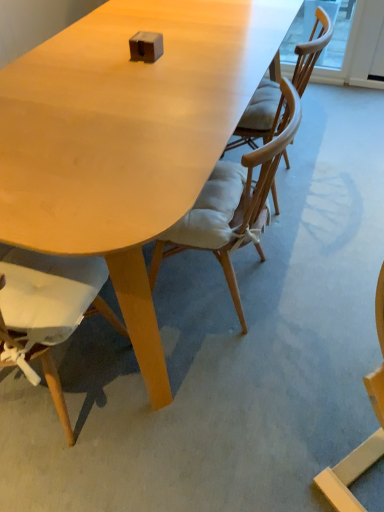
Question: From a real-world perspective, is light brown wood chair at center, which is counted as the 2th chair, starting from the right, positioned over matte wood chair at lower left, marked as the third chair in a right-to-left arrangement, based on gravity?

Choices:
 (A) yes
 (B) no

Answer: (B)

Question: Is matte wood chair at lower left, the first chair from the left, inside light brown wood chair at center, which is counted as the 2th chair, starting from the right?

Choices:
 (A) no
 (B) yes

Answer: (A)

Question: Can you confirm if light brown wood chair at center, which is counted as the 2th chair, starting from the right, is bigger than matte wood chair at lower left, the first chair from the left?

Choices:
 (A) yes
 (B) no

Answer: (B)

Question: Is light brown wood chair at center, which is counted as the second chair, starting from the left, positioned in front of matte wood chair at lower left, marked as the third chair in a right-to-left arrangement?

Choices:
 (A) no
 (B) yes

Answer: (A)

Question: Is light brown wood chair at center, which is counted as the 2th chair, starting from the right, beside matte wood chair at lower left, marked as the third chair in a right-to-left arrangement?

Choices:
 (A) no
 (B) yes

Answer: (A)

Question: From the image's perspective, is light brown wood chair at center, which is counted as the second chair, starting from the left, on matte wood chair at lower left, the first chair from the left?

Choices:
 (A) no
 (B) yes

Answer: (B)

Question: From the image's perspective, is wooden chair with cushion at center, positioned as the third chair in left-to-right order, above light brown wood chair at center, which is counted as the 2th chair, starting from the right?

Choices:
 (A) no
 (B) yes

Answer: (B)

Question: From the image's perspective, would you say wooden chair with cushion at center, placed as the 1th chair when sorted from right to left, is shown under light brown wood chair at center, which is counted as the 2th chair, starting from the right?

Choices:
 (A) no
 (B) yes

Answer: (A)

Question: Is wooden chair with cushion at center, positioned as the third chair in left-to-right order, located outside light brown wood chair at center, which is counted as the 2th chair, starting from the right?

Choices:
 (A) no
 (B) yes

Answer: (B)

Question: Are wooden chair with cushion at center, positioned as the third chair in left-to-right order, and light brown wood chair at center, which is counted as the 2th chair, starting from the right, making contact?

Choices:
 (A) yes
 (B) no

Answer: (B)

Question: From a real-world perspective, is wooden chair with cushion at center, positioned as the third chair in left-to-right order, below light brown wood chair at center, which is counted as the 2th chair, starting from the right?

Choices:
 (A) yes
 (B) no

Answer: (B)

Question: Considering the relative sizes of wooden chair with cushion at center, positioned as the third chair in left-to-right order, and light brown wood chair at center, which is counted as the 2th chair, starting from the right, in the image provided, is wooden chair with cushion at center, positioned as the third chair in left-to-right order, wider than light brown wood chair at center, which is counted as the 2th chair, starting from the right,?

Choices:
 (A) yes
 (B) no

Answer: (A)

Question: From a real-world perspective, is wooden chair with cushion at center, placed as the 1th chair when sorted from right to left, located higher than matte wood table at center?

Choices:
 (A) yes
 (B) no

Answer: (A)